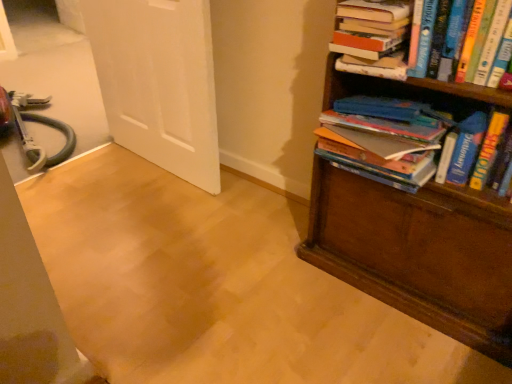
The height and width of the screenshot is (384, 512). Describe the element at coordinates (485, 42) in the screenshot. I see `hardcover book at upper right, the second book in the top-to-bottom sequence` at that location.

In order to face hardcover book at upper right, the second book in the top-to-bottom sequence, should I rotate leftwards or rightwards?

Rotate your view right by about 26.947°.

The height and width of the screenshot is (384, 512). Find the location of `white matte door at upper left`. white matte door at upper left is located at coordinates (158, 82).

At what (x,y) coordinates should I click in order to perform the action: click on brown wooden bookcase at right. Please return your answer as a coordinate pair (x, y). The width and height of the screenshot is (512, 384). Looking at the image, I should click on (419, 252).

Is hardcover book at upper right, the first book viewed from the top, a part of brown wooden bookcase at right?

Yes, brown wooden bookcase at right contains hardcover book at upper right, the first book viewed from the top.

From the image's perspective, is brown wooden bookcase at right below hardcover book at upper right, positioned as the third book in bottom-to-top order?

Yes.

Find the location of a particular element. the 3rd book behind the brown wooden bookcase at right is located at coordinates (372, 37).

Is brown wooden bookcase at right next to hardcover book at upper right, the first book viewed from the top?

brown wooden bookcase at right is not next to hardcover book at upper right, the first book viewed from the top, and they're not touching.

Does hardcover books at right, which is the 3th book in top-to-bottom order, touch hardcover book at upper right, positioned as the third book in bottom-to-top order?

hardcover books at right, which is the 3th book in top-to-bottom order, is not next to hardcover book at upper right, positioned as the third book in bottom-to-top order, and they're not touching.

Considering the sizes of objects hardcover books at right, the first book in the bottom-to-top sequence, and hardcover book at upper right, positioned as the third book in bottom-to-top order, in the image provided, who is bigger, hardcover books at right, the first book in the bottom-to-top sequence, or hardcover book at upper right, positioned as the third book in bottom-to-top order,?

Bigger between the two is hardcover books at right, the first book in the bottom-to-top sequence.

Between hardcover books at right, which is the 3th book in top-to-bottom order, and hardcover book at upper right, positioned as the third book in bottom-to-top order, which one is positioned in front?

Positioned in front is hardcover books at right, which is the 3th book in top-to-bottom order.

From the picture: Considering the relative positions of hardcover books at right, the first book in the bottom-to-top sequence, and hardcover book at upper right, positioned as the third book in bottom-to-top order, in the image provided, is hardcover books at right, the first book in the bottom-to-top sequence, to the right of hardcover book at upper right, positioned as the third book in bottom-to-top order, from the viewer's perspective?

Correct, you'll find hardcover books at right, the first book in the bottom-to-top sequence, to the right of hardcover book at upper right, positioned as the third book in bottom-to-top order.

How different are the orientations of hardcover book at upper right, positioned as the third book in bottom-to-top order, and brown wooden bookcase at right in degrees?

The angle between the facing direction of hardcover book at upper right, positioned as the third book in bottom-to-top order, and the facing direction of brown wooden bookcase at right is 0.0171 degrees.

Considering the relative sizes of hardcover book at upper right, positioned as the third book in bottom-to-top order, and brown wooden bookcase at right in the image provided, is hardcover book at upper right, positioned as the third book in bottom-to-top order, wider than brown wooden bookcase at right?

In fact, hardcover book at upper right, positioned as the third book in bottom-to-top order, might be narrower than brown wooden bookcase at right.

Do you think hardcover book at upper right, the first book viewed from the top, is within brown wooden bookcase at right, or outside of it?

hardcover book at upper right, the first book viewed from the top, can be found inside brown wooden bookcase at right.

Does hardcover book at upper right, positioned as the third book in bottom-to-top order, have a lesser width compared to hardcover books at right, which is the 3th book in top-to-bottom order?

Yes, hardcover book at upper right, positioned as the third book in bottom-to-top order, is thinner than hardcover books at right, which is the 3th book in top-to-bottom order.

Is hardcover book at upper right, positioned as the third book in bottom-to-top order, taller than hardcover books at right, which is the 3th book in top-to-bottom order?

No, hardcover book at upper right, positioned as the third book in bottom-to-top order, is not taller than hardcover books at right, which is the 3th book in top-to-bottom order.

Is hardcover book at upper right, positioned as the third book in bottom-to-top order, positioned with its back to hardcover books at right, which is the 3th book in top-to-bottom order?

That's not correct — hardcover book at upper right, positioned as the third book in bottom-to-top order, is not looking away from hardcover books at right, which is the 3th book in top-to-bottom order.

From the image's perspective, which one is positioned lower, hardcover book at upper right, the first book viewed from the top, or hardcover books at right, which is the 3th book in top-to-bottom order?

hardcover books at right, which is the 3th book in top-to-bottom order.

Is hardcover book at upper right, which ranks as the second book in bottom-to-top order, bigger or smaller than hardcover book at upper right, the first book viewed from the top?

hardcover book at upper right, which ranks as the second book in bottom-to-top order, is bigger than hardcover book at upper right, the first book viewed from the top.

From the image's perspective, which is above, hardcover book at upper right, which ranks as the second book in bottom-to-top order, or hardcover book at upper right, the first book viewed from the top?

From the image's view, hardcover book at upper right, the first book viewed from the top, is above.

Identify the location of the 2nd book in front of the hardcover book at upper right, the first book viewed from the top. The height and width of the screenshot is (384, 512). (485, 42).

Is hardcover book at upper right, which ranks as the second book in bottom-to-top order, spatially inside hardcover book at upper right, the first book viewed from the top, or outside of it?

hardcover book at upper right, which ranks as the second book in bottom-to-top order, exists outside the volume of hardcover book at upper right, the first book viewed from the top.

Based on their positions, is white matte door at upper left located to the left or right of hardcover books at right, the first book in the bottom-to-top sequence?

white matte door at upper left is positioned on hardcover books at right, the first book in the bottom-to-top sequence,'s left side.

Is white matte door at upper left spatially inside hardcover books at right, which is the 3th book in top-to-bottom order, or outside of it?

white matte door at upper left is spatially situated outside hardcover books at right, which is the 3th book in top-to-bottom order.

Does white matte door at upper left have a smaller size compared to hardcover books at right, which is the 3th book in top-to-bottom order?

Actually, white matte door at upper left might be larger than hardcover books at right, which is the 3th book in top-to-bottom order.

Where is `door on the left of brown wooden bookcase at right`? This screenshot has width=512, height=384. door on the left of brown wooden bookcase at right is located at coordinates (158, 82).

Considering the sizes of objects brown wooden bookcase at right and white matte door at upper left in the image provided, who is wider, brown wooden bookcase at right or white matte door at upper left?

With larger width is brown wooden bookcase at right.

From a real-world perspective, is brown wooden bookcase at right above or below white matte door at upper left?

In terms of real-world spatial position, brown wooden bookcase at right is above white matte door at upper left.

Looking at this image, what's the angular difference between brown wooden bookcase at right and white matte door at upper left's facing directions?

2 degrees separate the facing orientations of brown wooden bookcase at right and white matte door at upper left.

Locate an element on the screen. bookcase on the right of hardcover book at upper right, positioned as the third book in bottom-to-top order is located at coordinates (419, 252).

Locate an element on the screen. book behind the hardcover books at right, the first book in the bottom-to-top sequence is located at coordinates (372, 37).

When comparing their distances from brown wooden bookcase at right, does hardcover book at upper right, the first book viewed from the top, or hardcover book at upper right, which ranks as the second book in bottom-to-top order, seem further?

The object further to brown wooden bookcase at right is hardcover book at upper right, the first book viewed from the top.

Estimate the real-world distances between objects in this image. Which object is further from hardcover books at right, the first book in the bottom-to-top sequence, white matte door at upper left or hardcover book at upper right, the first book viewed from the top?

Based on the image, white matte door at upper left appears to be further to hardcover books at right, the first book in the bottom-to-top sequence.

From the picture: When comparing their distances from white matte door at upper left, does hardcover book at upper right, the first book viewed from the top, or brown wooden bookcase at right seem further?

The object further to white matte door at upper left is hardcover book at upper right, the first book viewed from the top.

Based on their spatial positions, is hardcover book at upper right, positioned as the third book in bottom-to-top order, or hardcover book at upper right, the second book in the top-to-bottom sequence, closer to hardcover books at right, which is the 3th book in top-to-bottom order?

hardcover book at upper right, the second book in the top-to-bottom sequence.

Based on their spatial positions, is hardcover books at right, the first book in the bottom-to-top sequence, or hardcover book at upper right, the second book in the top-to-bottom sequence, further from hardcover book at upper right, the first book viewed from the top?

Among the two, hardcover books at right, the first book in the bottom-to-top sequence, is located further to hardcover book at upper right, the first book viewed from the top.

When comparing their distances from white matte door at upper left, does hardcover book at upper right, which ranks as the second book in bottom-to-top order, or brown wooden bookcase at right seem closer?

brown wooden bookcase at right is positioned closer to the anchor white matte door at upper left.

Which object lies nearer to the anchor point hardcover book at upper right, the second book in the top-to-bottom sequence, brown wooden bookcase at right or hardcover books at right, the first book in the bottom-to-top sequence?

hardcover books at right, the first book in the bottom-to-top sequence.

When comparing their distances from white matte door at upper left, does hardcover book at upper right, the first book viewed from the top, or hardcover books at right, which is the 3th book in top-to-bottom order, seem closer?

Based on the image, hardcover books at right, which is the 3th book in top-to-bottom order, appears to be nearer to white matte door at upper left.

Where is `book between hardcover book at upper right, the first book viewed from the top, and hardcover books at right, the first book in the bottom-to-top sequence, in the vertical direction`? book between hardcover book at upper right, the first book viewed from the top, and hardcover books at right, the first book in the bottom-to-top sequence, in the vertical direction is located at coordinates (485, 42).

Image resolution: width=512 pixels, height=384 pixels. What are the coordinates of `book located between white matte door at upper left and hardcover books at right, the first book in the bottom-to-top sequence, in the left-right direction` in the screenshot? It's located at (372, 37).

Locate an element on the screen. This screenshot has width=512, height=384. book between hardcover book at upper right, the second book in the top-to-bottom sequence, and brown wooden bookcase at right, in the vertical direction is located at coordinates (399, 141).